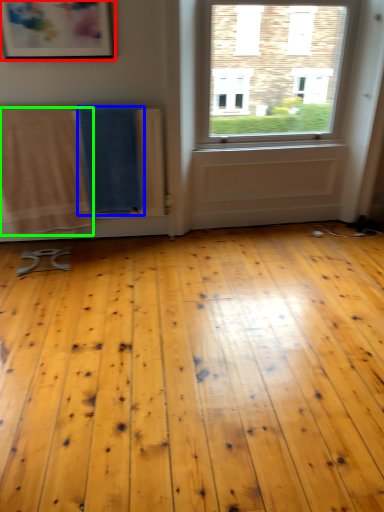
Question: Estimate the real-world distances between objects in this image. Which object is farther from picture frame (highlighted by a red box), beach towel (highlighted by a blue box) or beach towel (highlighted by a green box)?

Choices:
 (A) beach towel
 (B) beach towel

Answer: (B)